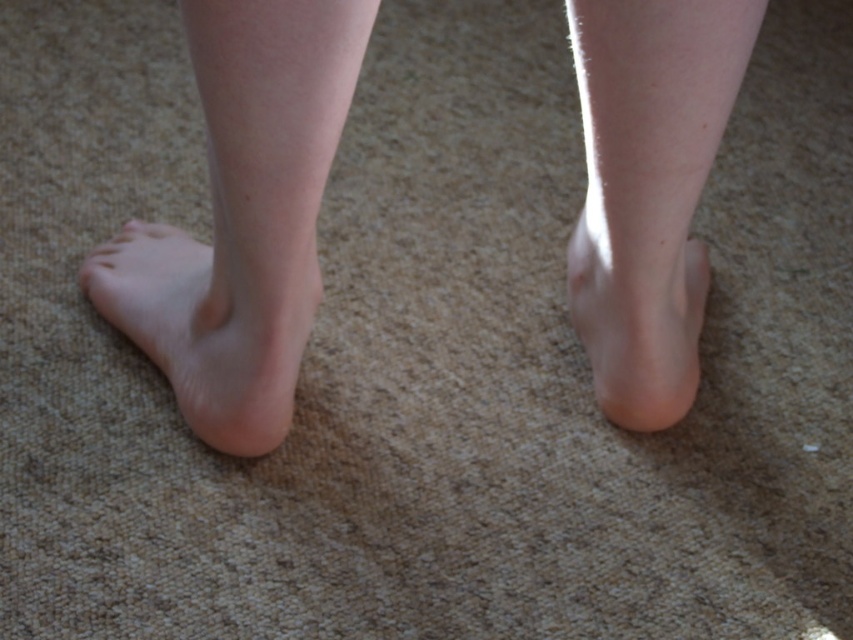
You are a physical therapist assessing the body proportions of a patient. You observe the smooth skin leg at center and the smooth skin foot at center in the image. Which body part has a greater width according to the provided information?

The smooth skin leg at center has a greater width than the smooth skin foot at center, as stated in the description.

You are a medical student examining a closeup of two feet on a carpet. You notice a point labeled at coordinates [242,218]. Based on the scene description, where is this point located?

The point at coordinates [242,218] is located on the smooth skin leg at left.

You are a physical therapist observing the positioning of the smooth skin leg at center and the smooth skin foot at center. Which body part is closer to the viewer?

The smooth skin leg at center is closer to the viewer because it is positioned in front of the smooth skin foot at center.